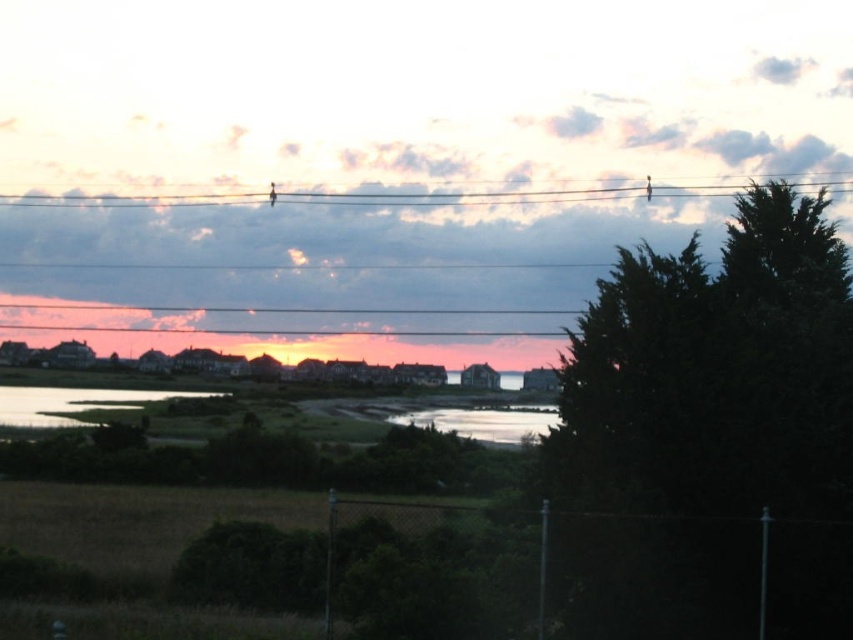
Does black wire at upper center appear on the right side of silvery reflective water at center?

No, black wire at upper center is not to the right of silvery reflective water at center.

Which is below, black wire at upper center or silvery reflective water at center?

silvery reflective water at center is below.

Between point (15, 193) and point (440, 412), which one is positioned behind?

The point (15, 193) is more distant.

Where is `black wire at upper center`? black wire at upper center is located at coordinates (372, 196).

The height and width of the screenshot is (640, 853). Describe the element at coordinates (372, 196) in the screenshot. I see `black wire at upper center` at that location.

Who is positioned more to the left, black wire at upper center or green grassy water at lower left?

From the viewer's perspective, green grassy water at lower left appears more on the left side.

This screenshot has width=853, height=640. Find the location of `black wire at upper center`. black wire at upper center is located at coordinates (372, 196).

I want to click on black wire at upper center, so click(x=372, y=196).

Is point (627, 449) behind point (146, 202)?

That is False.

Based on the photo, can you confirm if dark green textured tree at right is positioned above black wire at upper center?

Incorrect, dark green textured tree at right is not positioned above black wire at upper center.

Between point (677, 308) and point (0, 205), which one is positioned in front?

Positioned in front is point (677, 308).

Image resolution: width=853 pixels, height=640 pixels. I want to click on dark green textured tree at right, so click(714, 376).